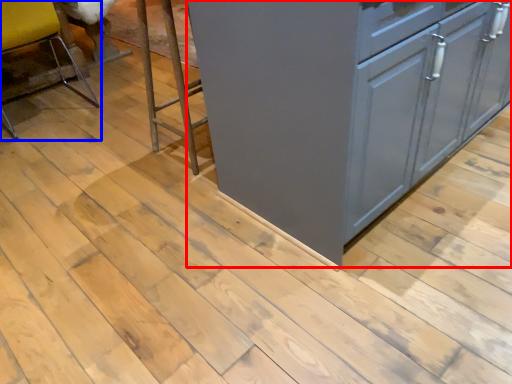
Question: Which point is closer to the camera, cabinetry (highlighted by a red box) or chair (highlighted by a blue box)?

Choices:
 (A) cabinetry
 (B) chair

Answer: (A)